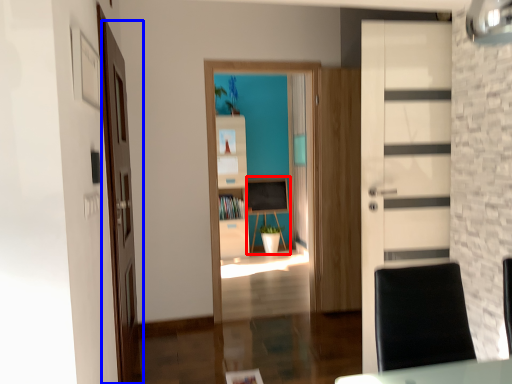
Question: Among these objects, which one is nearest to the camera, computer desk (highlighted by a red box) or door (highlighted by a blue box)?

Choices:
 (A) computer desk
 (B) door

Answer: (B)